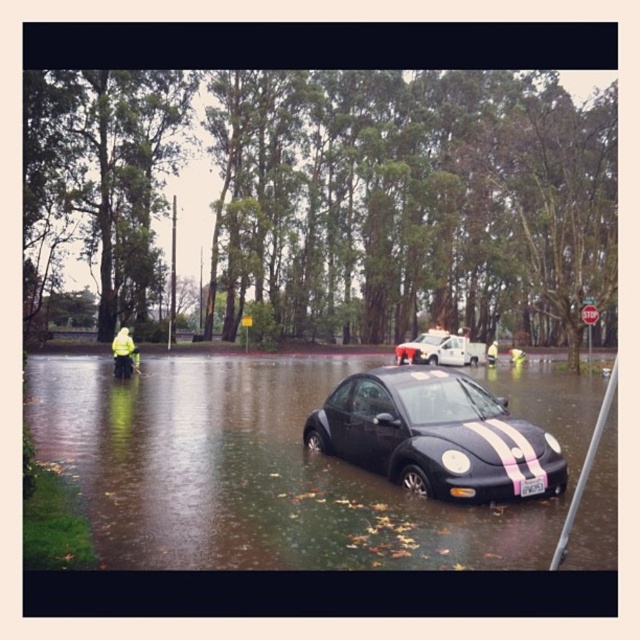
You are standing at the edge of the flooded street. There is a point marked at coordinates (433, 435). Which object does this point correspond to?

The point at coordinates (433, 435) corresponds to the shiny black car at center.

You are a driver trying to navigate through the flooded street. You see the point at coordinates (433, 435). What object is located at that point?

The point at coordinates (433, 435) corresponds to the shiny black car at center.